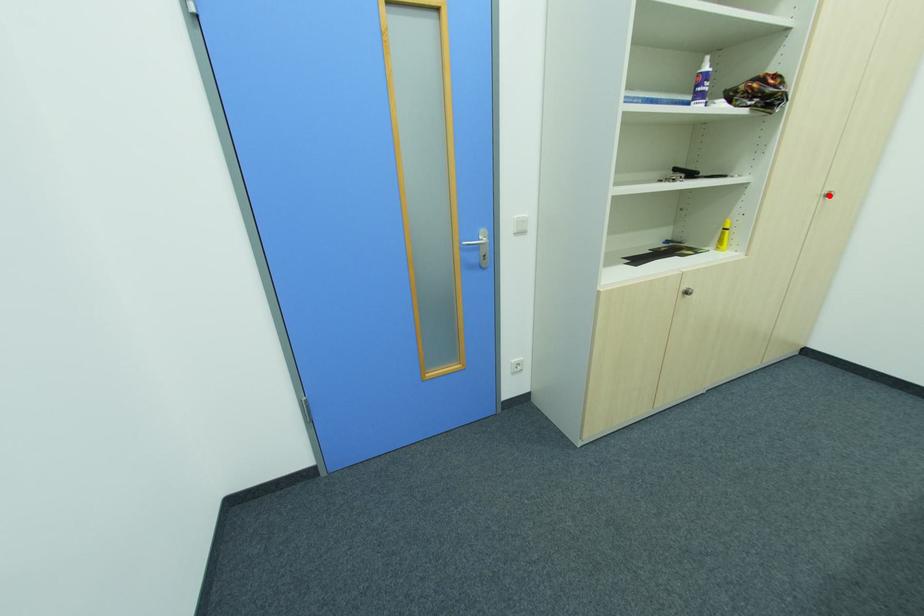
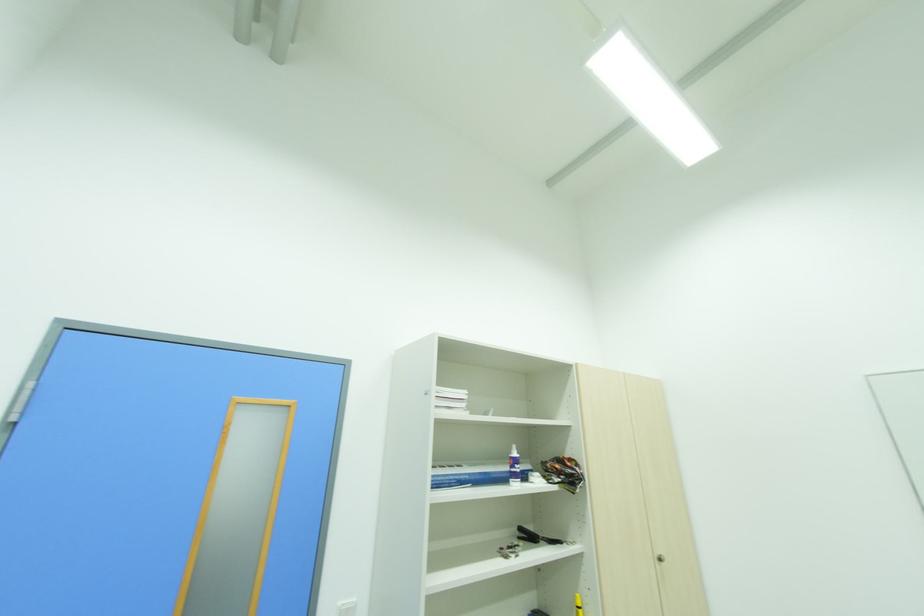
Find the pixel in the second image that matches the highlighted location in the first image.

(663, 561)